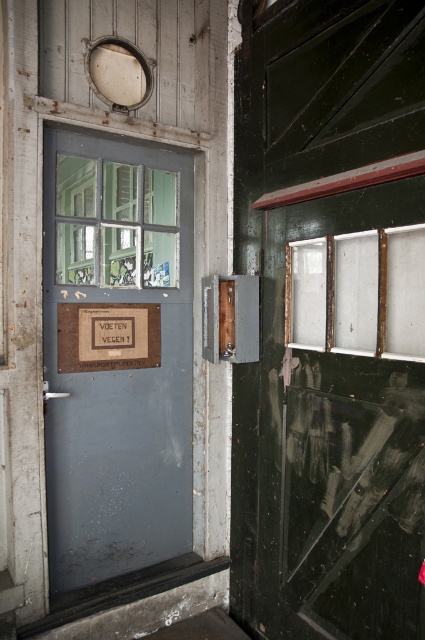
Between rusty metal door at center and brown cardboard sign at center, which one appears on the left side from the viewer's perspective?

brown cardboard sign at center

The image size is (425, 640). What do you see at coordinates (116, 355) in the screenshot? I see `rusty metal door at center` at bounding box center [116, 355].

You are a GUI agent. You are given a task and a screenshot of the screen. Output one action in this format:
    pyautogui.click(x=<x>, y=<y>)
    Task: Click on the rusty metal door at center
    This screenshot has height=640, width=425.
    Given the screenshot: What is the action you would take?
    pyautogui.click(x=116, y=355)